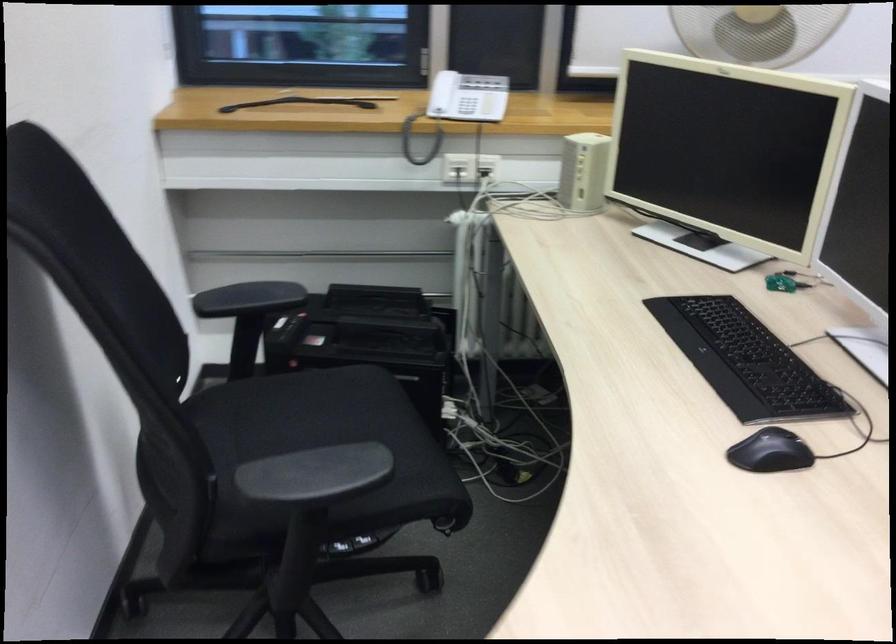
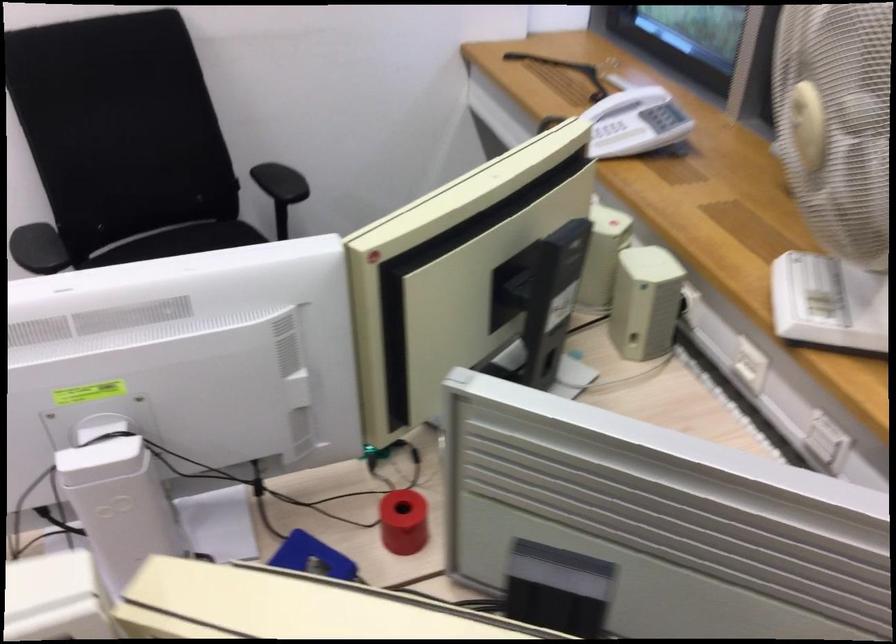
Find the pixel in the second image that matches (x=461, y=97) in the first image.

(617, 138)